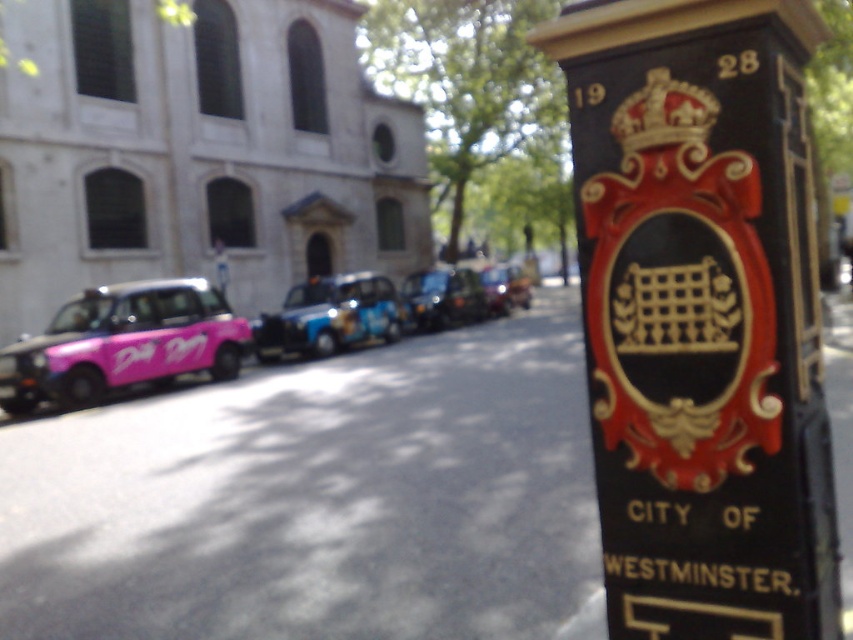
From the picture: You are a delivery person trying to load a large package onto the roof of a taxi. You have two options in front of you, the blue metallic taxi at center and the metallic blue taxi at center. Which taxi would allow you to place the package on its roof without it touching the ground?

The metallic blue taxi at center has a greater height than the blue metallic taxi at center, so placing the large package on its roof would be possible without it touching the ground.